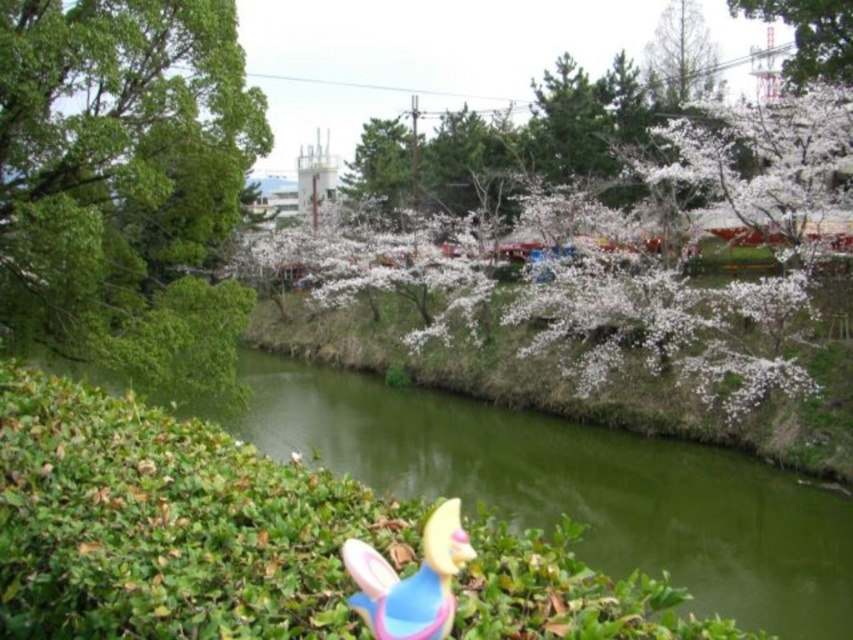
Question: Is green smooth water at center smaller than pastel plastic bunny at lower center?

Choices:
 (A) yes
 (B) no

Answer: (B)

Question: Where is green smooth water at center located in relation to pastel plastic bunny at lower center in the image?

Choices:
 (A) above
 (B) below

Answer: (B)

Question: Among these points, which one is farthest from the camera?

Choices:
 (A) (695, 42)
 (B) (839, 16)
 (C) (30, 122)
 (D) (358, 572)

Answer: (A)

Question: Estimate the real-world distances between objects in this image. Which object is closer to the green leafy tree at upper right?

Choices:
 (A) green leafy tree at left
 (B) smooth brown tree trunk at upper right
 (C) pastel plastic bunny at lower center
 (D) green smooth water at center

Answer: (B)

Question: Which object is farther from the camera taking this photo?

Choices:
 (A) pastel plastic bunny at lower center
 (B) green smooth water at center
 (C) smooth brown tree trunk at upper right
 (D) green leafy tree at left

Answer: (C)

Question: Can you confirm if green smooth water at center is positioned to the right of smooth brown tree trunk at upper right?

Choices:
 (A) yes
 (B) no

Answer: (B)